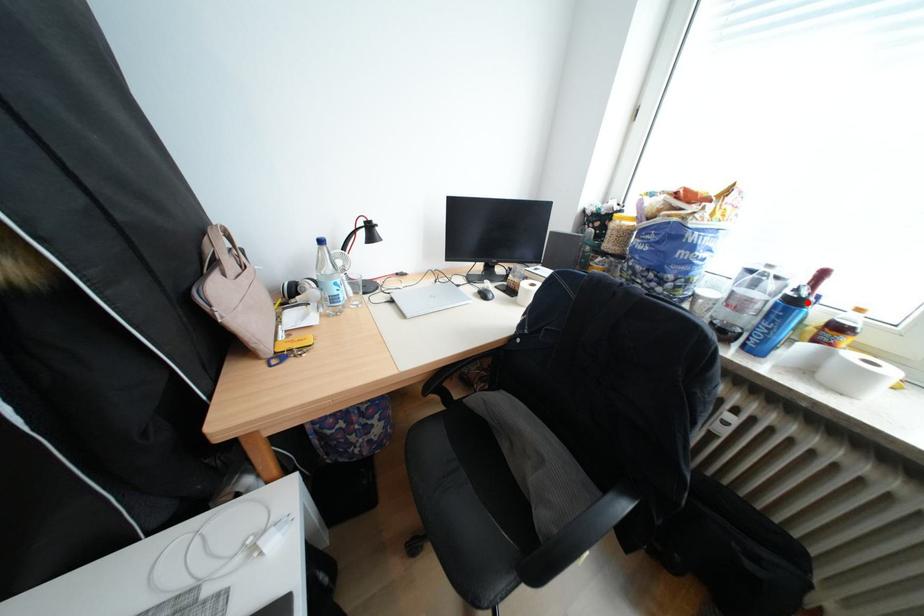
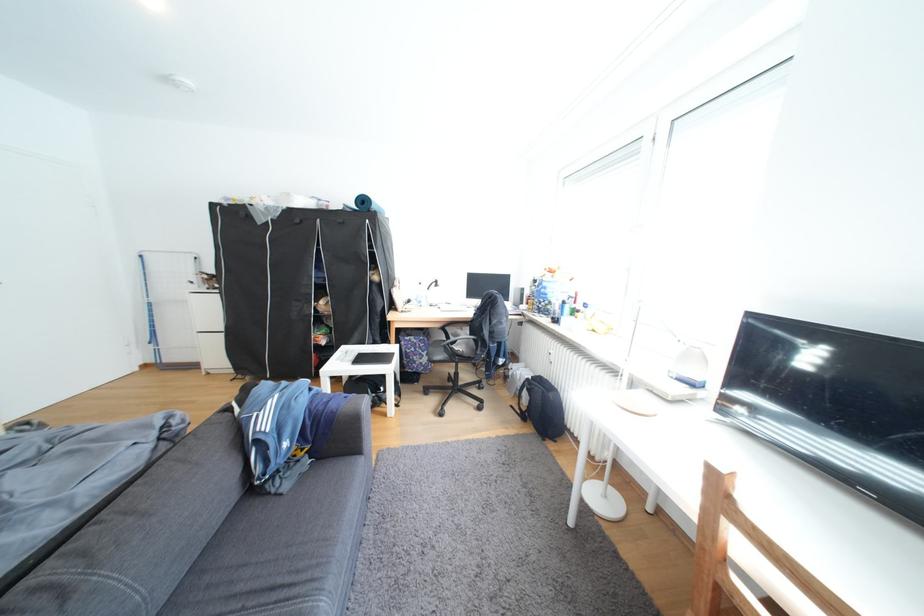
Question: I am providing you with two images of the same scene from different viewpoints. A red point is marked on the first image. At the location where the point appears in image 1, is it still visible in image 2?

Choices:
 (A) Yes
 (B) No

Answer: (B)